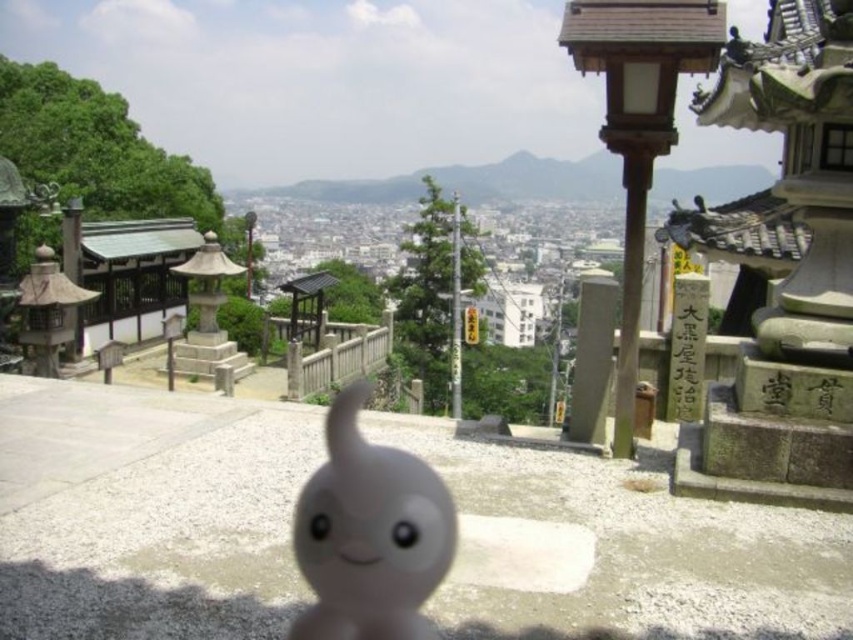
Can you confirm if gray stone pillar at center is positioned above white stone signpost at right?

No.

Is gray stone pillar at center positioned behind white stone signpost at right?

No.

Who is more distant from viewer, [595,436] or [701,388]?

Point [701,388]

Identify the location of gray stone pillar at center. The height and width of the screenshot is (640, 853). (592, 356).

Can you confirm if white matte ghost at center is positioned below gray stone pillar at center?

No.

What do you see at coordinates (369, 534) in the screenshot?
I see `white matte ghost at center` at bounding box center [369, 534].

Locate an element on the screen. The image size is (853, 640). white matte ghost at center is located at coordinates (369, 534).

Can you confirm if white matte ghost at center is wider than white stone signpost at right?

Correct, the width of white matte ghost at center exceeds that of white stone signpost at right.

Which is above, white matte ghost at center or white stone signpost at right?

white stone signpost at right is above.

The height and width of the screenshot is (640, 853). Identify the location of white matte ghost at center. (369, 534).

Image resolution: width=853 pixels, height=640 pixels. What are the coordinates of `white matte ghost at center` in the screenshot? It's located at (369, 534).